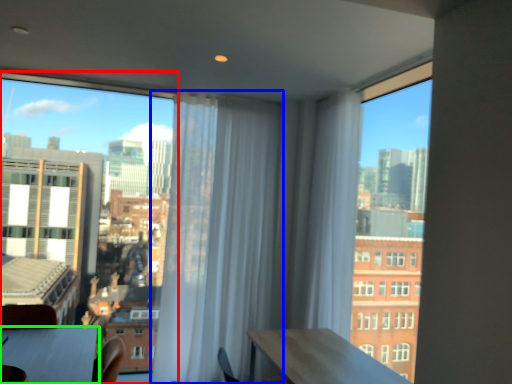
Question: Considering the real-world distances, which object is farthest from window (highlighted by a red box)? curtain (highlighted by a blue box) or table (highlighted by a green box)?

Choices:
 (A) curtain
 (B) table

Answer: (B)